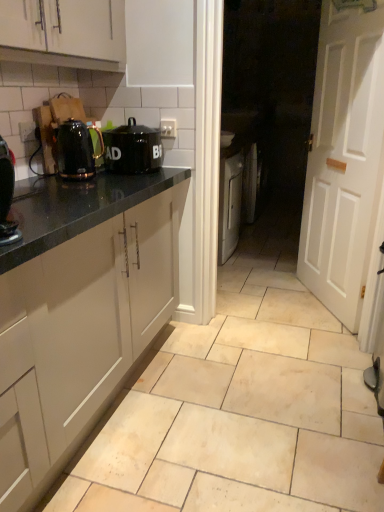
Question: Is shiny black kettle at left taller or shorter than beige ceramic tile at center?

Choices:
 (A) short
 (B) tall

Answer: (B)

Question: From a real-world perspective, is shiny black kettle at left above or below beige ceramic tile at center?

Choices:
 (A) below
 (B) above

Answer: (B)

Question: Which object is the farthest from the white wooden door at right?

Choices:
 (A) black matte canister at upper center
 (B) shiny black kettle at left
 (C) black glossy coffee machine at left
 (D) white matte cabinet at upper left
 (E) beige ceramic tile at center

Answer: (C)

Question: Which object is positioned farthest from the black matte canister at upper center?

Choices:
 (A) black glossy coffee machine at left
 (B) white wooden door at right
 (C) shiny black kettle at left
 (D) white matte cabinet at upper left
 (E) beige ceramic tile at center

Answer: (B)